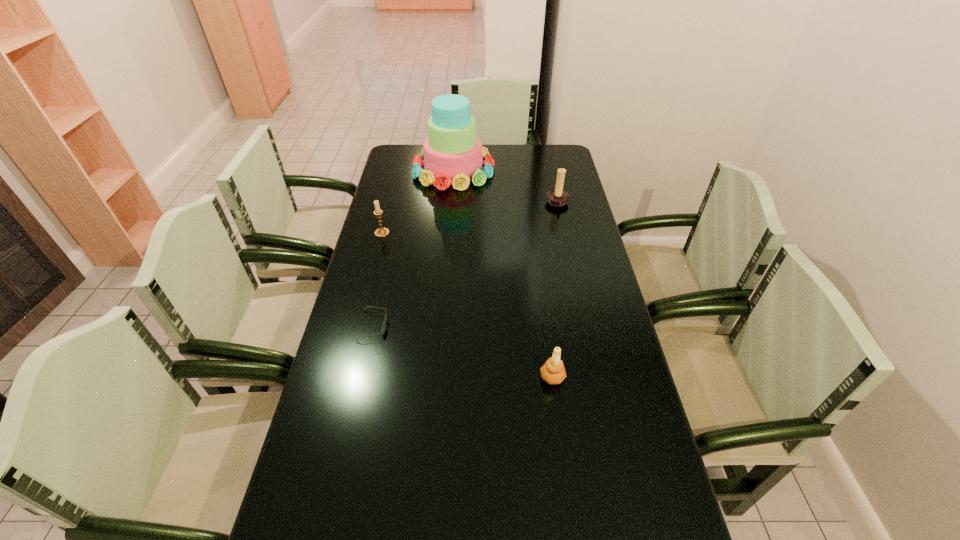
Find the location of `sunglasses located in the left edge section of the desktop`. sunglasses located in the left edge section of the desktop is located at coordinates (383, 327).

Locate an element on the screen. The height and width of the screenshot is (540, 960). object located at the right edge is located at coordinates (557, 197).

This screenshot has height=540, width=960. I want to click on object located at the far left corner, so click(x=452, y=153).

Locate an element on the screen. vacant space at the left edge of the desktop is located at coordinates (341, 460).

In the image, there is a desktop. Where is `vacant space at the right edge`? This screenshot has width=960, height=540. vacant space at the right edge is located at coordinates (578, 227).

I want to click on free space between the shortest object and the nearest candle_holder, so click(x=463, y=352).

At what (x,y) coordinates should I click in order to perform the action: click on vacant area that lies between the second candle_holder from right to left and the farthest object. Please return your answer as a coordinate pair (x, y). Looking at the image, I should click on (503, 273).

Locate an element on the screen. Image resolution: width=960 pixels, height=540 pixels. vacant area that lies between the cake and the farthest candle_holder is located at coordinates (506, 187).

Locate an element on the screen. The height and width of the screenshot is (540, 960). unoccupied position between the nearest candle_holder and the cake is located at coordinates (503, 273).

Locate an element on the screen. vacant space in between the second candle_holder from left to right and the second nearest candle_holder is located at coordinates (468, 305).